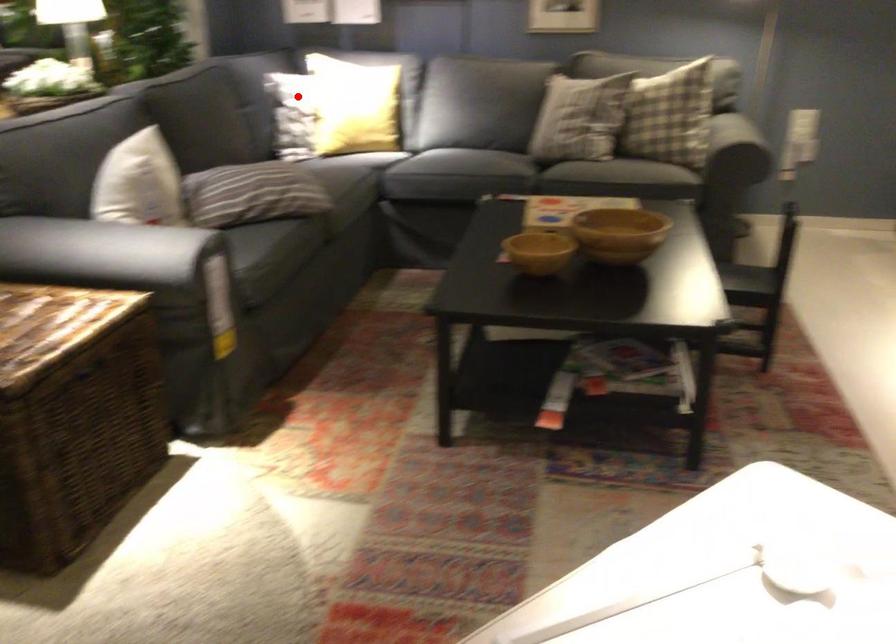
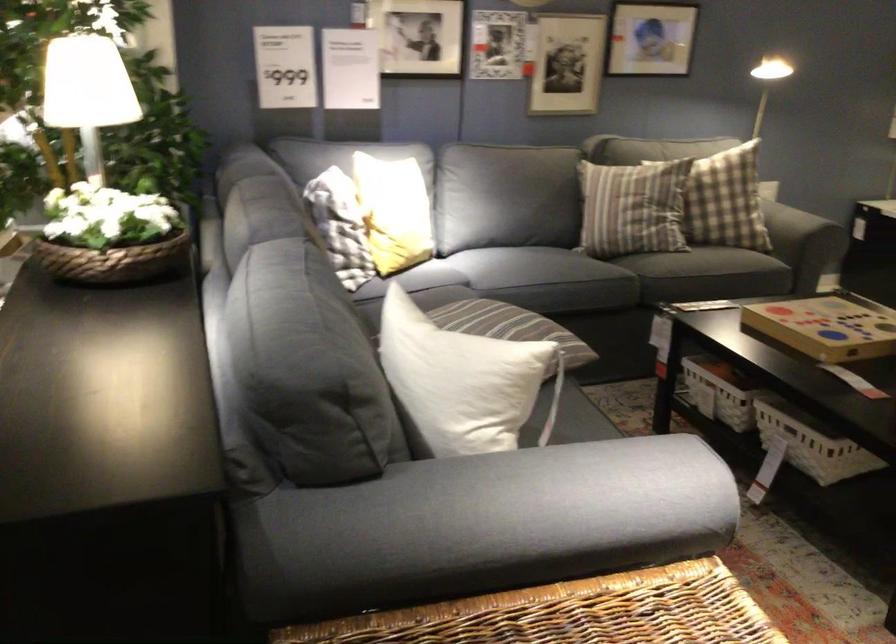
Question: I am providing you with two images of the same scene from different viewpoints. Given a red point in image1, look at the same physical point in image2. Is it:

Choices:
 (A) Closer to the viewpoint
 (B) Farther from the viewpoint

Answer: (A)